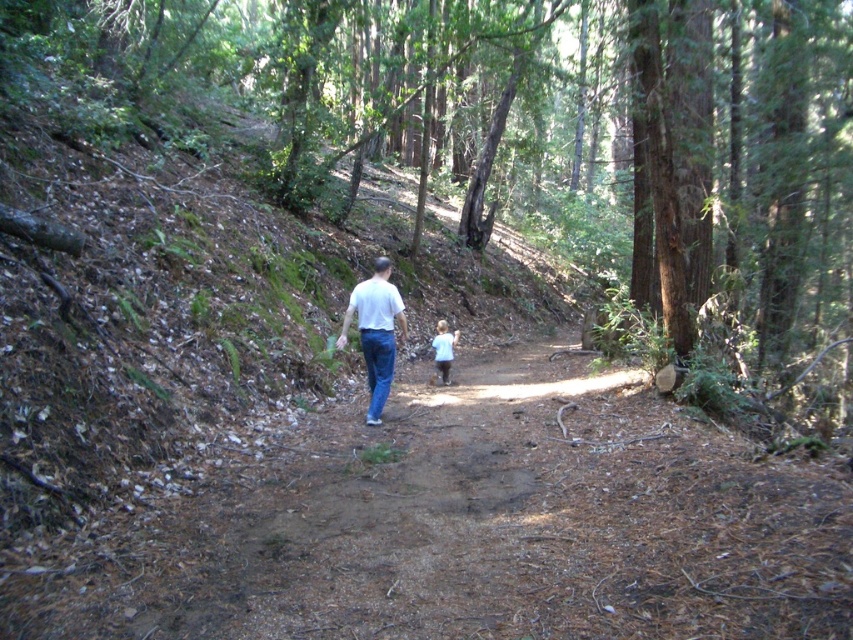
Question: Which point is farther to the camera?

Choices:
 (A) white matte shirt at center
 (B) light brown hair at center

Answer: (B)

Question: Is white matte shirt at center positioned behind light brown hair at center?

Choices:
 (A) yes
 (B) no

Answer: (B)

Question: Can you confirm if blue denim jeans at center is positioned to the left of light brown hair at center?

Choices:
 (A) no
 (B) yes

Answer: (B)

Question: Which object is closer to the camera taking this photo?

Choices:
 (A) light brown hair at center
 (B) white matte shirt at center

Answer: (B)

Question: Which of the following is the closest to the observer?

Choices:
 (A) blue denim jeans at center
 (B) light brown hair at center
 (C) white matte shirt at center

Answer: (A)

Question: Is white matte shirt at center in front of blue denim jeans at center?

Choices:
 (A) no
 (B) yes

Answer: (A)